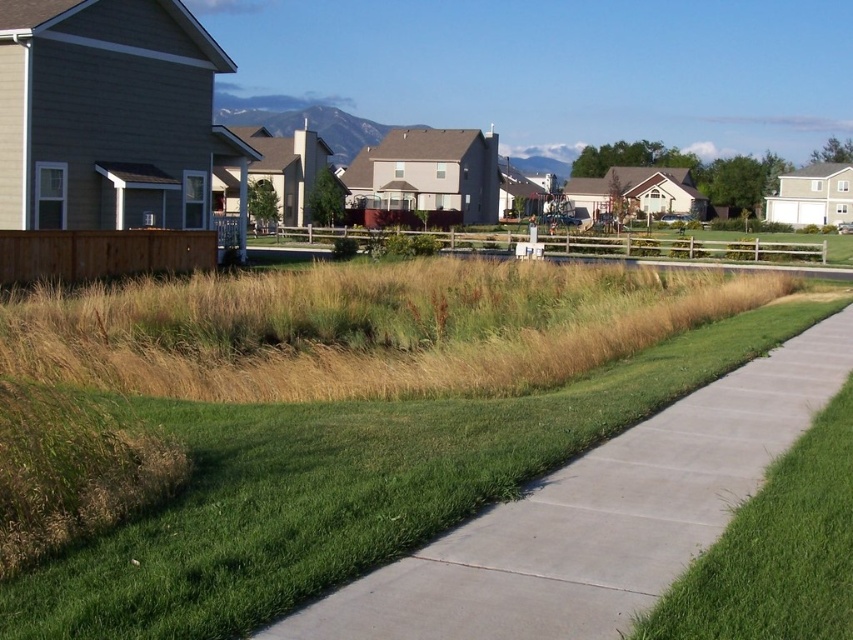
You are a gardener assessing the lawn in the suburban neighborhood scene. You notice two areas of green grass at center and green grass at lower right. Which area requires more fertilizer based on their sizes?

The green grass at center requires more fertilizer because it is larger in size than the green grass at lower right, indicating it may need more nutrients to maintain its growth.

You are a gardener who needs to mow the lawn. You observe the green grass at center and the green grass at lower right. Which area requires immediate attention based on their heights?

The green grass at center requires immediate attention because it has a greater height compared to the green grass at lower right, indicating it needs to be mowed sooner.